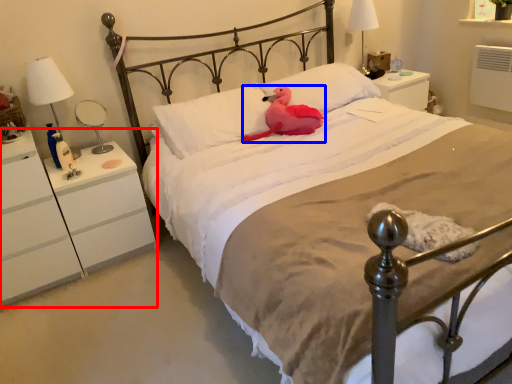
Question: Which point is closer to the camera, nightstand (highlighted by a red box) or animal (highlighted by a blue box)?

Choices:
 (A) nightstand
 (B) animal

Answer: (A)